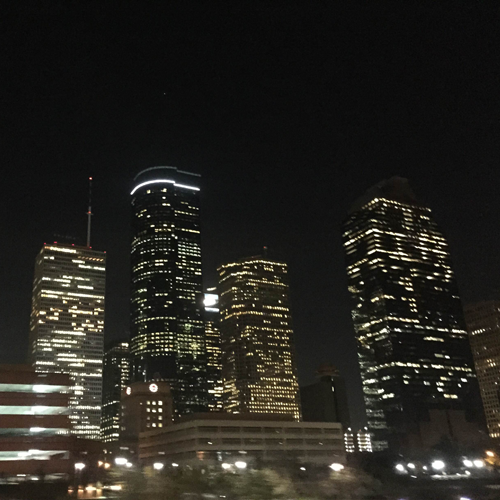
Identify the location of yellowish light. The width and height of the screenshot is (500, 500). (489, 459).